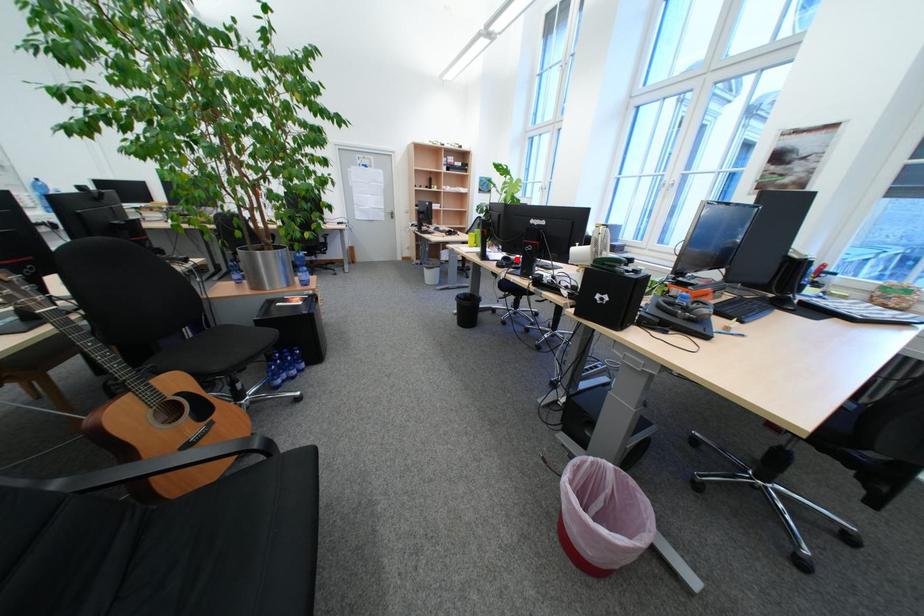
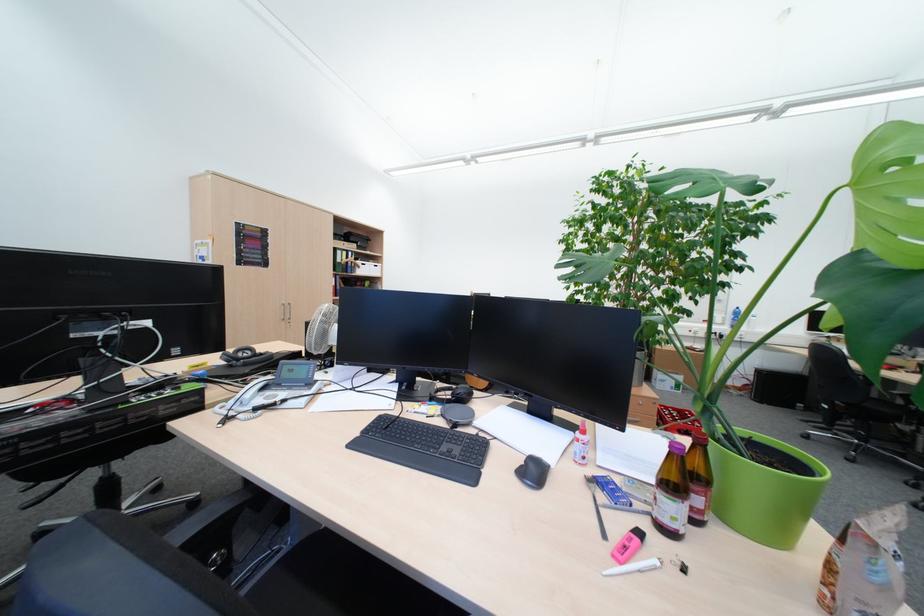
Question: I am providing you with two images of the same scene from different viewpoints. A red point is marked on the first image. Can you still see the location of the red point in image 2?

Choices:
 (A) Yes
 (B) No

Answer: (B)